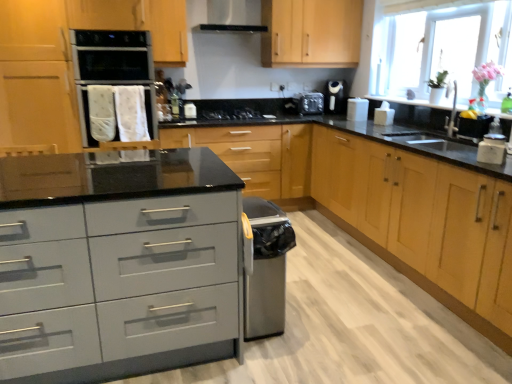
Question: Is transparent glass window at upper right spatially inside black matte gas stove at center, or outside of it?

Choices:
 (A) inside
 (B) outside

Answer: (B)

Question: In terms of width, does transparent glass window at upper right look wider or thinner when compared to black matte gas stove at center?

Choices:
 (A) thin
 (B) wide

Answer: (A)

Question: Which object is positioned farthest from the black plastic toaster at upper center, which is counted as the third appliance, starting from the front?

Choices:
 (A) transparent glass window at upper right
 (B) white glossy toaster at upper right, positioned as the second appliance in back-to-front order
 (C) satin black oven at upper center
 (D) light wood/texture cabinet at right, the 1th cabinetry in the right-to-left sequence
 (E) white fabric oven mitts at upper left

Answer: (C)

Question: Which is farther from the light wood/texture cabinet at right, positioned as the third cabinetry in left-to-right order?

Choices:
 (A) white fabric oven mitts at upper left
 (B) satin black exhaust hood at upper center
 (C) matte gray drawer at center
 (D) black plastic toaster at upper center, placed as the third appliance when sorted from right to left
 (E) white matte sugar container at right

Answer: (B)